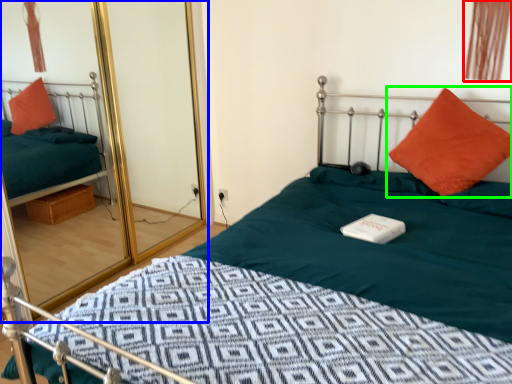
Question: Which is farther away from curtain (highlighted by a red box)? glass door (highlighted by a blue box) or pillow (highlighted by a green box)?

Choices:
 (A) glass door
 (B) pillow

Answer: (A)